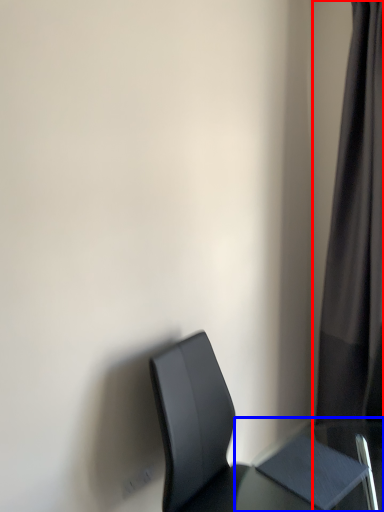
Question: Which object appears closest to the camera in this image, curtain (highlighted by a red box) or table (highlighted by a blue box)?

Choices:
 (A) curtain
 (B) table

Answer: (B)